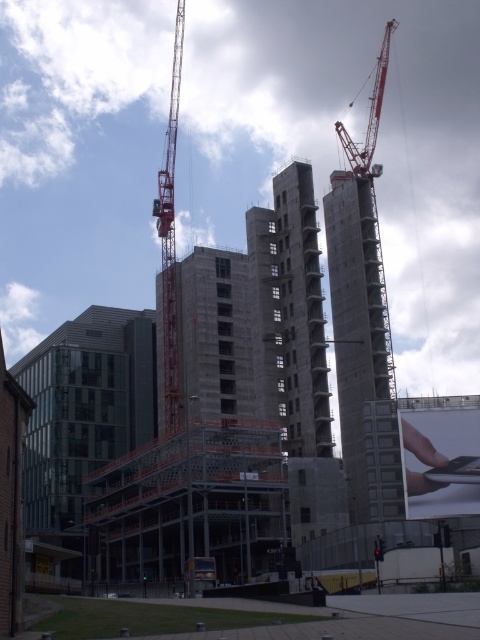
You are a construction worker standing at the point marked at coordinates (361, 346). Looking around, you see the concrete tower at center and the modern glass building in the foreground. Which building is closer to your current position?

The concrete tower at center is located at the point marked at coordinates (361, 346), so you are standing right at the base of the concrete tower at center. Therefore, the concrete tower at center is the closest building to your current position.

Looking at this image, you are a drone operator trying to capture aerial footage of the construction site. You have two points marked on your map for potential takeoff locations. The first is at point (168, 310) and the second at point (388, 385). Which point is closer to the camera position?

Point (168, 310) is closer to the camera position because it is further to the viewer than point (388, 385).